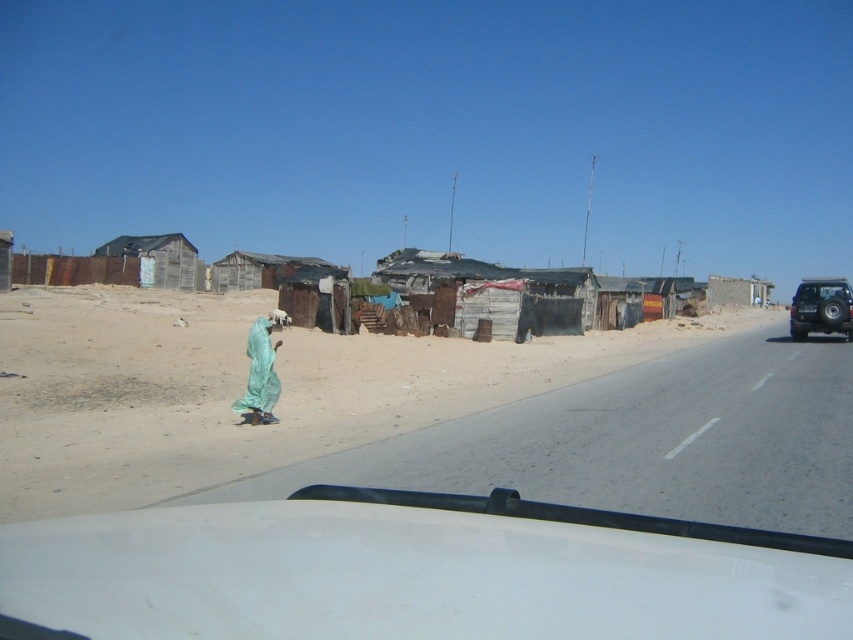
Question: Which object is farther from the camera taking this photo?

Choices:
 (A) brown dirt at lower left
 (B) dark gray wooden hut at left
 (C) brushed metal jeep at right
 (D) white matte car at lower center

Answer: (B)

Question: Is brushed metal jeep at right wider than green fabric at center?

Choices:
 (A) no
 (B) yes

Answer: (B)

Question: Which point is closer to the camera?

Choices:
 (A) white matte car at lower center
 (B) brushed metal jeep at right
 (C) green fabric at center

Answer: (A)

Question: Can you confirm if dark gray wooden hut at left is smaller than brushed metal jeep at right?

Choices:
 (A) yes
 (B) no

Answer: (B)

Question: Does dark gray wooden hut at left appear on the left side of brushed metal jeep at right?

Choices:
 (A) yes
 (B) no

Answer: (A)

Question: Which point is farther to the camera?

Choices:
 (A) brown dirt at lower left
 (B) green fabric at center

Answer: (B)